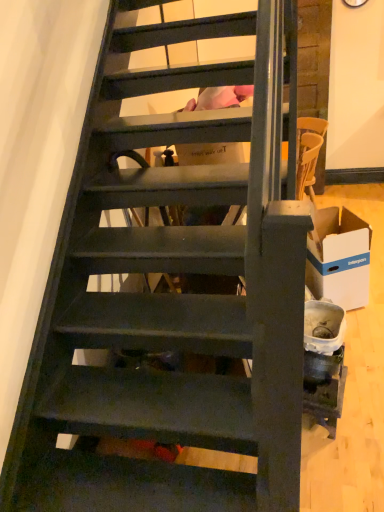
The height and width of the screenshot is (512, 384). Describe the element at coordinates (339, 258) in the screenshot. I see `white cardboard box at lower right` at that location.

At what (x,y) coordinates should I click in order to perform the action: click on white cardboard box at lower right. Please return your answer as a coordinate pair (x, y). The image size is (384, 512). Looking at the image, I should click on (339, 258).

This screenshot has width=384, height=512. I want to click on white cardboard box at lower right, so click(x=339, y=258).